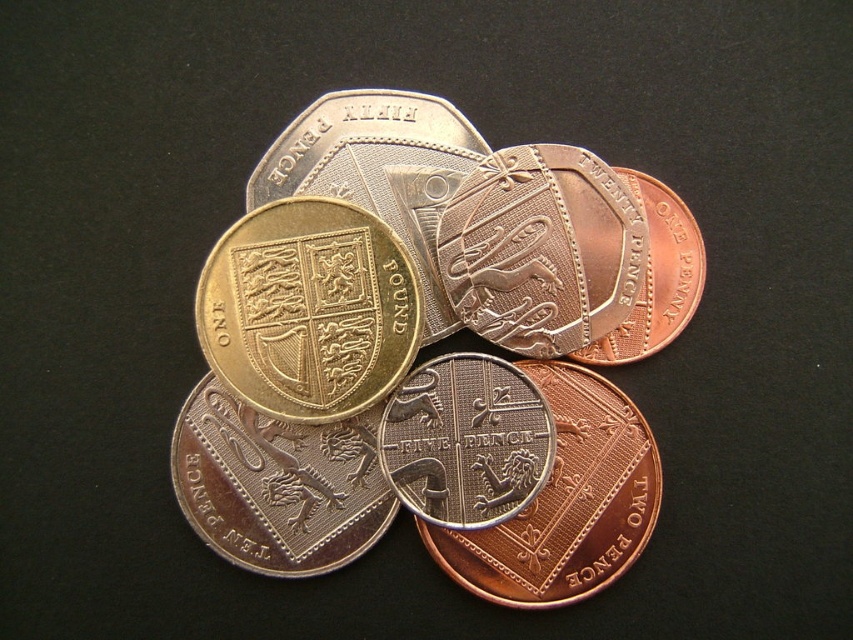
The width and height of the screenshot is (853, 640). What do you see at coordinates (308, 308) in the screenshot?
I see `gold-plated coin at center` at bounding box center [308, 308].

Can you confirm if gold-plated coin at center is bigger than shiny silver coin at center?

Yes, gold-plated coin at center is bigger than shiny silver coin at center.

Who is more forward, [393,257] or [460,234]?

Positioned in front is point [393,257].

Find the location of a particular element. The image size is (853, 640). gold-plated coin at center is located at coordinates (308, 308).

Which is more to the right, shiny silver coin at center or silver textured five pence at center?

shiny silver coin at center

Does point (485, 291) lie in front of point (454, 506)?

No, it is not.

Is point (540, 307) positioned before point (448, 493)?

No, (540, 307) is behind (448, 493).

Where is `shiny silver coin at center`? This screenshot has width=853, height=640. shiny silver coin at center is located at coordinates (541, 250).

Is shiny silver coin at center further to camera compared to brass-like metallic five pence at center?

Yes, shiny silver coin at center is behind brass-like metallic five pence at center.

Is shiny silver coin at center to the right of brass-like metallic five pence at center from the viewer's perspective?

In fact, shiny silver coin at center is to the left of brass-like metallic five pence at center.

Is point (480, 305) positioned before point (570, 484)?

No, it is behind (570, 484).

Image resolution: width=853 pixels, height=640 pixels. What are the coordinates of `shiny silver coin at center` in the screenshot? It's located at (541, 250).